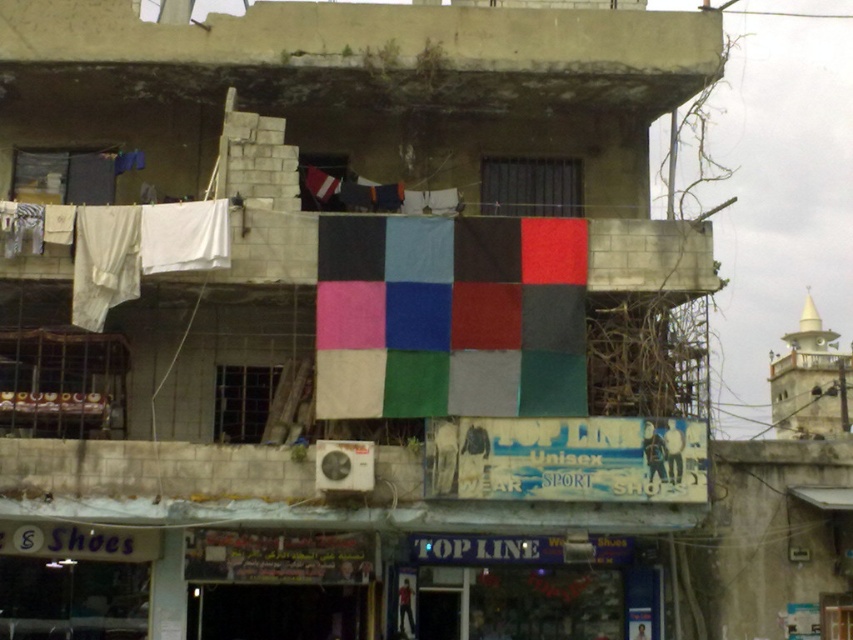
You are a city planner analyzing the building facade. The textile flag at center and the matte fabric flag at upper center are both part of the building decor. Which flag is shorter in height?

The textile flag at center has a lesser height compared to the matte fabric flag at upper center, so the textile flag at center is shorter.

You are a delivery person approaching the building and see the textile flag at center and the matte fabric flag at upper center. Which flag is positioned more to the east side of the building?

The textile flag at center is to the right of matte fabric flag at upper center, so if facing the building, the textile flag at center is more to the east side.

You are a delivery person who needs to park your van between the textile flag at center and the matte fabric flag at upper center. Can you fit your van, which is 2 meters wide, in the space between them?

The textile flag at center is narrower than the matte fabric flag at upper center. However, the distance between them isn not specified in the objects description. Therefore, it is impossible to determine if the van can fit based on the given information.